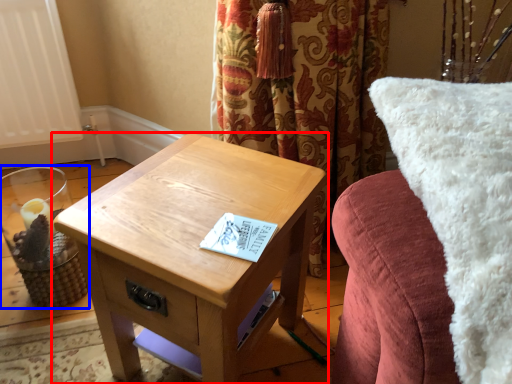
Question: Which object is closer to the camera taking this photo, table (highlighted by a red box) or candle holder (highlighted by a blue box)?

Choices:
 (A) table
 (B) candle holder

Answer: (A)